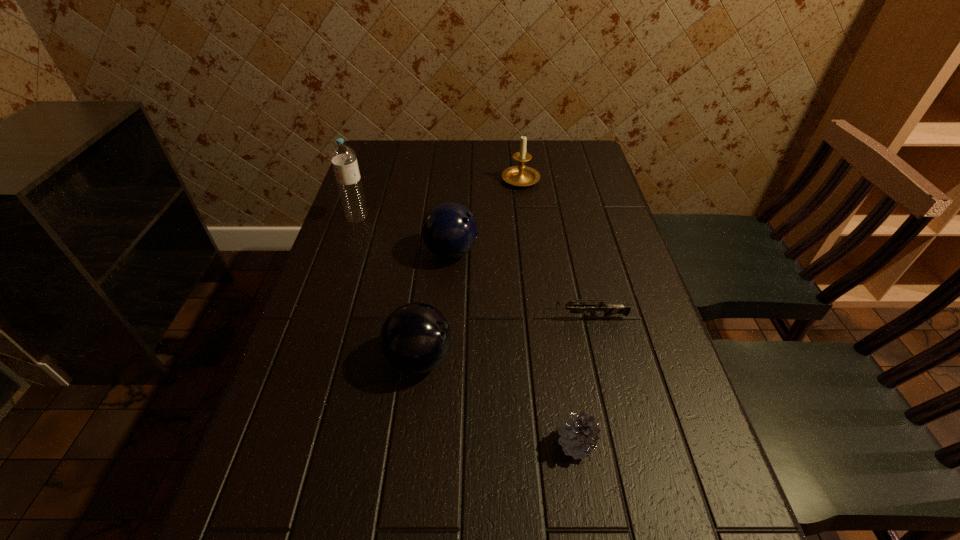
The height and width of the screenshot is (540, 960). In order to click on free spot between the gun and the fourth nearest object in this screenshot , I will do `click(518, 285)`.

The height and width of the screenshot is (540, 960). What are the coordinates of `vacant area that lies between the nearer bowling ball and the candle holder` in the screenshot? It's located at (470, 268).

Where is `unoccupied position between the water bottle and the third nearest object`? unoccupied position between the water bottle and the third nearest object is located at coordinates (471, 268).

This screenshot has height=540, width=960. I want to click on free spot between the tallest object and the candle holder, so click(439, 198).

Find the location of a particular element. This screenshot has width=960, height=540. vacant area that lies between the nearer bowling ball and the leftmost object is located at coordinates (389, 288).

Find the location of a particular element. The image size is (960, 540). vacant space that is in between the gun and the second farthest object is located at coordinates click(x=471, y=268).

Select which object is the fifth closest to the nearer bowling ball. Please provide its 2D coordinates. Your answer should be formatted as a tuple, i.e. [(x, y)], where the tuple contains the x and y coordinates of a point satisfying the conditions above.

[(521, 175)]

Select which object is the third closest to the fourth nearest object. Please provide its 2D coordinates. Your answer should be formatted as a tuple, i.e. [(x, y)], where the tuple contains the x and y coordinates of a point satisfying the conditions above.

[(609, 309)]

Locate an element on the screen. The width and height of the screenshot is (960, 540). blank space that satisfies the following two spatial constraints: 1. on the surface of the nearest object near the finger holes; 2. on the right side of the third farthest object is located at coordinates (437, 444).